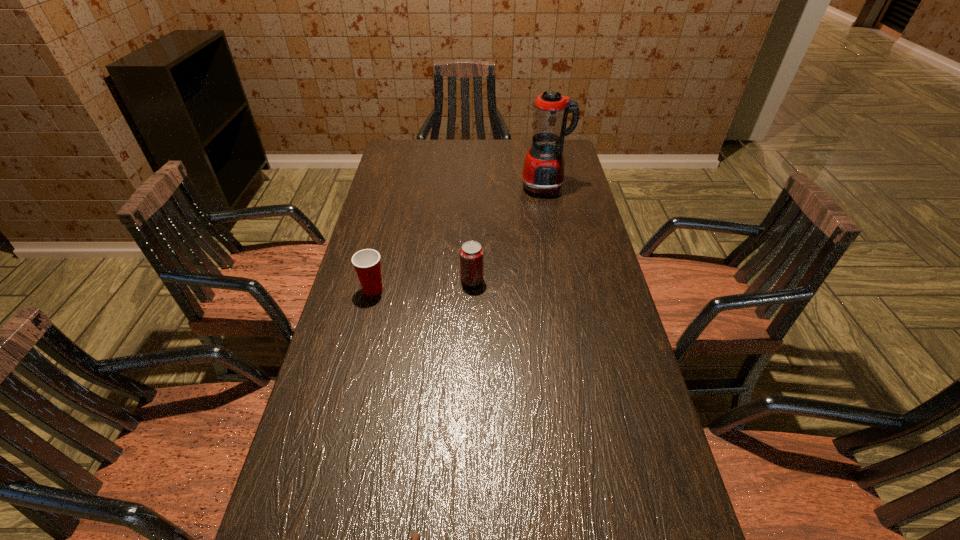
Find the location of a particular element. Image resolution: width=960 pixels, height=540 pixels. the tallest object is located at coordinates (543, 170).

Where is `food processor`? The width and height of the screenshot is (960, 540). food processor is located at coordinates (543, 170).

Where is `the second object from right to left`? the second object from right to left is located at coordinates (471, 253).

Where is `Dixie cup`? The height and width of the screenshot is (540, 960). Dixie cup is located at coordinates (366, 262).

Find the location of `free point located 0.340m on the controls of the farthest object`. free point located 0.340m on the controls of the farthest object is located at coordinates (559, 264).

Image resolution: width=960 pixels, height=540 pixels. In order to click on vacant position located 0.280m on the logo side of the second object from right to left in this screenshot , I will do `click(582, 280)`.

You are a GUI agent. You are given a task and a screenshot of the screen. Output one action in this format:
    pyautogui.click(x=<x>, y=<y>)
    Task: Click on the free space located 0.230m on the front of the Dixie cup
    This screenshot has width=960, height=540.
    Given the screenshot: What is the action you would take?
    pyautogui.click(x=353, y=370)

This screenshot has height=540, width=960. Find the location of `object at the left edge`. object at the left edge is located at coordinates (366, 262).

Find the location of `object at the right edge`. object at the right edge is located at coordinates (543, 170).

Where is `free space at the far edge of the desktop`? free space at the far edge of the desktop is located at coordinates (440, 143).